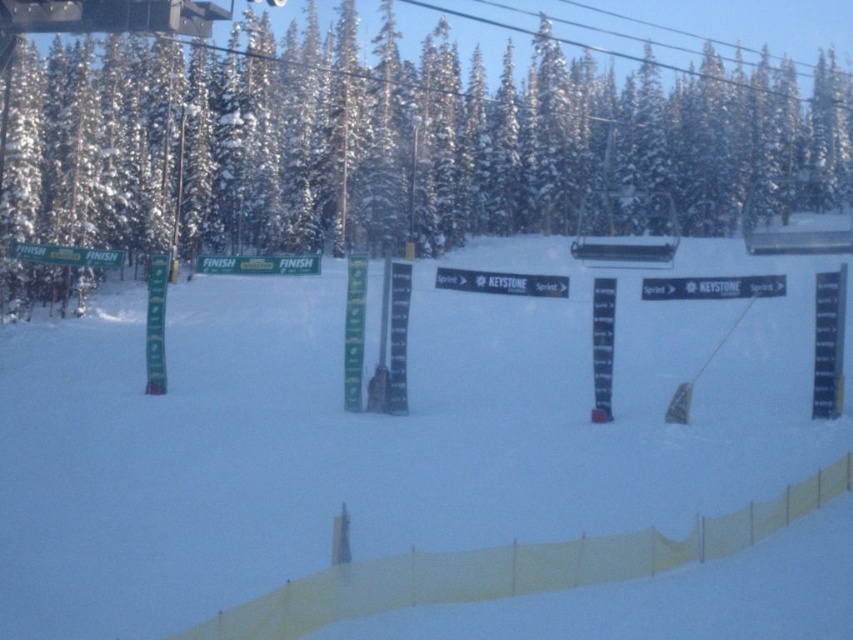
Question: Which of the following is the closest to the observer?

Choices:
 (A) (532, 451)
 (B) (410, 230)

Answer: (A)

Question: From the image, what is the correct spatial relationship of white snow ski slope at center in relation to white snow-covered tree at center?

Choices:
 (A) left
 (B) right

Answer: (A)

Question: Does white snow ski slope at center have a smaller size compared to white snow-covered tree at center?

Choices:
 (A) no
 (B) yes

Answer: (B)

Question: Among these objects, which one is farthest from the camera?

Choices:
 (A) white snow-covered tree at center
 (B) white snow ski slope at center

Answer: (A)

Question: Does white snow ski slope at center come in front of white snow-covered tree at center?

Choices:
 (A) no
 (B) yes

Answer: (B)